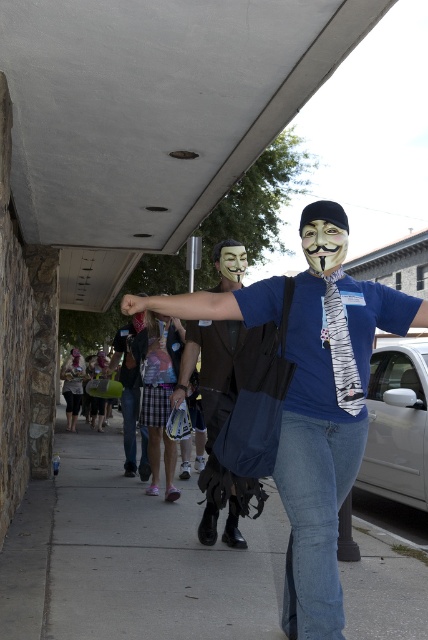
This screenshot has width=428, height=640. In order to click on blue fabric shirt at center in this screenshot , I will do `click(187, 305)`.

Can you confirm if blue fabric shirt at center is shorter than matte brown suit at center?

No, blue fabric shirt at center is not shorter than matte brown suit at center.

The width and height of the screenshot is (428, 640). What do you see at coordinates (187, 305) in the screenshot?
I see `blue fabric shirt at center` at bounding box center [187, 305].

Find the location of a particular element. blue fabric shirt at center is located at coordinates (187, 305).

Is gray concrete sidewalk at lower center wider than matte black mask at center?

Yes, gray concrete sidewalk at lower center is wider than matte black mask at center.

Between gray concrete sidewalk at lower center and matte black mask at center, which one is positioned lower?

gray concrete sidewalk at lower center

Who is more forward, (x=133, y=545) or (x=326, y=256)?

Point (x=326, y=256) is in front.

The width and height of the screenshot is (428, 640). What are the coordinates of `gray concrete sidewalk at lower center` in the screenshot? It's located at (131, 557).

Does matte black mask at center have a smaller size compared to matte white mask at center?

Correct, matte black mask at center occupies less space than matte white mask at center.

Between point (336, 268) and point (234, 257), which one is positioned in front?

Point (336, 268) is more forward.

The height and width of the screenshot is (640, 428). What do you see at coordinates (323, 244) in the screenshot?
I see `matte black mask at center` at bounding box center [323, 244].

The image size is (428, 640). I want to click on matte black mask at center, so click(x=323, y=244).